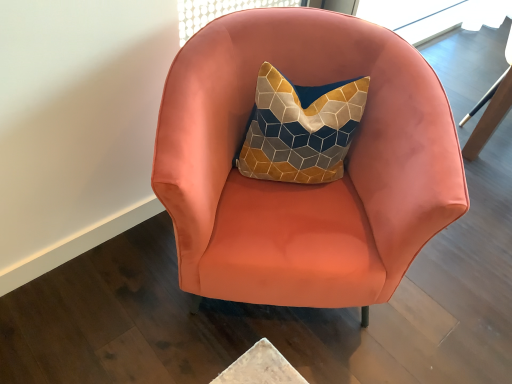
The image size is (512, 384). Describe the element at coordinates (489, 115) in the screenshot. I see `matte coral swivel chair at right` at that location.

Identify the location of matte coral swivel chair at right. Image resolution: width=512 pixels, height=384 pixels. (489, 115).

Locate an element on the screen. Image resolution: width=512 pixels, height=384 pixels. satin coral armchair at center is located at coordinates (304, 185).

Image resolution: width=512 pixels, height=384 pixels. Describe the element at coordinates (304, 185) in the screenshot. I see `satin coral armchair at center` at that location.

This screenshot has height=384, width=512. I want to click on matte coral swivel chair at right, so click(489, 115).

Which is more to the right, satin coral armchair at center or matte coral swivel chair at right?

Positioned to the right is matte coral swivel chair at right.

Which object is further away from the camera taking this photo, satin coral armchair at center or matte coral swivel chair at right?

matte coral swivel chair at right.

Which is nearer, (x=221, y=275) or (x=481, y=142)?

Point (x=221, y=275)

From the image's perspective, relative to matte coral swivel chair at right, is satin coral armchair at center above or below?

Based on their image positions, satin coral armchair at center is located beneath matte coral swivel chair at right.

From a real-world perspective, who is located higher, satin coral armchair at center or matte coral swivel chair at right?

From a 3D spatial view, satin coral armchair at center is above.

Can you confirm if satin coral armchair at center is thinner than matte coral swivel chair at right?

No.

Considering the relative sizes of satin coral armchair at center and matte coral swivel chair at right in the image provided, is satin coral armchair at center taller than matte coral swivel chair at right?

Correct, satin coral armchair at center is much taller as matte coral swivel chair at right.

Considering the relative sizes of satin coral armchair at center and matte coral swivel chair at right in the image provided, is satin coral armchair at center bigger than matte coral swivel chair at right?

Correct, satin coral armchair at center is larger in size than matte coral swivel chair at right.

Would you say satin coral armchair at center is outside matte coral swivel chair at right?

Yes.

Are satin coral armchair at center and matte coral swivel chair at right far apart?

Yes.

Does satin coral armchair at center turn towards matte coral swivel chair at right?

No.

How far apart are satin coral armchair at center and matte coral swivel chair at right?

3.91 feet.

What are the coordinates of `swivel chair lying on the right of satin coral armchair at center` in the screenshot? It's located at 489,115.

Considering the relative positions of matte coral swivel chair at right and satin coral armchair at center in the image provided, is matte coral swivel chair at right to the left of satin coral armchair at center from the viewer's perspective?

No.

In the image, is matte coral swivel chair at right positioned in front of or behind satin coral armchair at center?

In the image, matte coral swivel chair at right appears behind satin coral armchair at center.

Is point (493, 92) closer to viewer compared to point (358, 133)?

No, (493, 92) is behind (358, 133).

From the image's perspective, which is below, matte coral swivel chair at right or satin coral armchair at center?

satin coral armchair at center appears lower in the image.

From a real-world perspective, is matte coral swivel chair at right above or below satin coral armchair at center?

Clearly, from a real-world perspective, matte coral swivel chair at right is below satin coral armchair at center.

Can you confirm if matte coral swivel chair at right is wider than satin coral armchair at center?

Incorrect, the width of matte coral swivel chair at right does not surpass that of satin coral armchair at center.

Can you confirm if matte coral swivel chair at right is taller than satin coral armchair at center?

No.

Between matte coral swivel chair at right and satin coral armchair at center, which one has smaller size?

matte coral swivel chair at right is smaller.

Is matte coral swivel chair at right completely or partially outside of satin coral armchair at center?

That's correct, matte coral swivel chair at right is outside of satin coral armchair at center.

Is matte coral swivel chair at right directly adjacent to satin coral armchair at center?

matte coral swivel chair at right is not next to satin coral armchair at center, and they're not touching.

Is matte coral swivel chair at right aimed at satin coral armchair at center?

No, matte coral swivel chair at right is not turned towards satin coral armchair at center.

The image size is (512, 384). I want to click on chair located in front of the matte coral swivel chair at right, so click(x=304, y=185).

This screenshot has height=384, width=512. Identify the location of chair located above the matte coral swivel chair at right (from a real-world perspective). (304, 185).

This screenshot has width=512, height=384. What are the coordinates of `swivel chair on the right of satin coral armchair at center` in the screenshot? It's located at (489, 115).